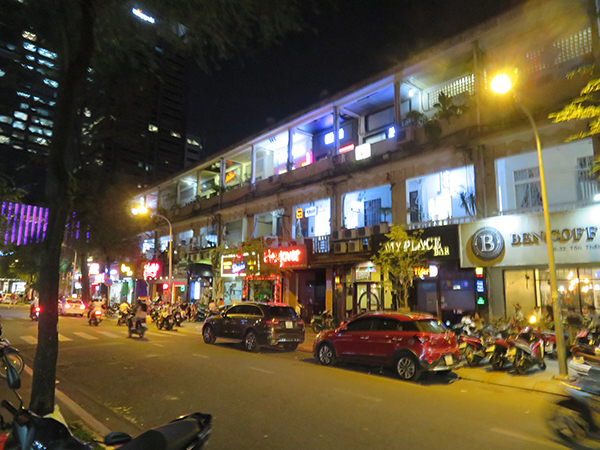
Where is `3 floor in this building`? This screenshot has width=600, height=450. 3 floor in this building is located at coordinates (451, 290), (446, 192), (434, 109).